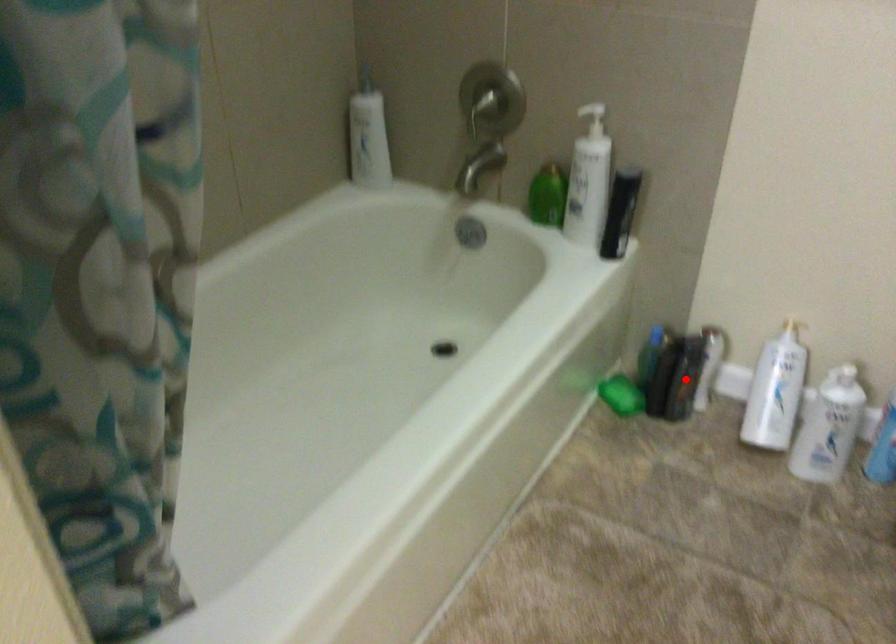
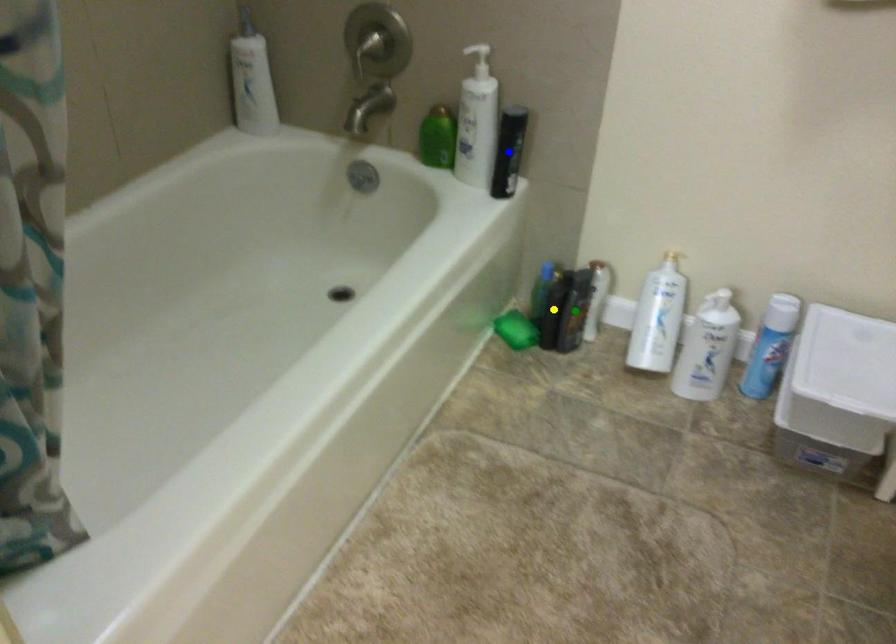
Question: I am providing you with two images of the same scene from different viewpoints. A red point is marked on the first image. You are given multiple points on the second image. Which point in image 2 is actually the same real-world point as the red point in image 1?

Choices:
 (A) green point
 (B) yellow point
 (C) blue point

Answer: (A)